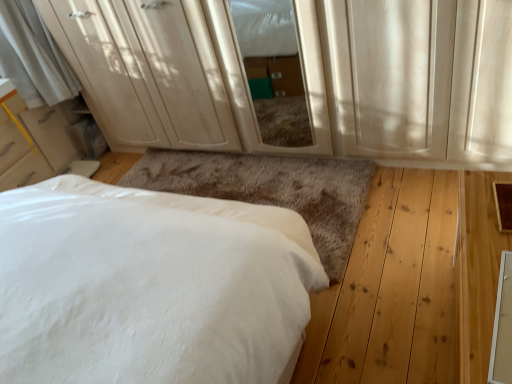
The height and width of the screenshot is (384, 512). What do you see at coordinates (148, 286) in the screenshot?
I see `white soft bed at lower left` at bounding box center [148, 286].

The image size is (512, 384). I want to click on matte wood screen door at center, so click(x=247, y=82).

The width and height of the screenshot is (512, 384). What do you see at coordinates (146, 71) in the screenshot? I see `matte white dresser at upper center` at bounding box center [146, 71].

This screenshot has height=384, width=512. I want to click on white soft bed at lower left, so click(x=148, y=286).

From the image's perspective, is white soft bed at lower left located beneath matte wood screen door at center?

Correct, white soft bed at lower left appears lower than matte wood screen door at center in the image.

How different are the orientations of white soft bed at lower left and matte wood screen door at center in degrees?

The angle between the facing direction of white soft bed at lower left and the facing direction of matte wood screen door at center is 0.261 degrees.

Is white soft bed at lower left taller or shorter than matte wood screen door at center?

Clearly, white soft bed at lower left is shorter compared to matte wood screen door at center.

Is white soft bed at lower left looking in the opposite direction of matte wood screen door at center?

No, white soft bed at lower left is not facing away from matte wood screen door at center.

Considering the sizes of objects white soft bed at lower left and matte white dresser at upper center in the image provided, who is thinner, white soft bed at lower left or matte white dresser at upper center?

matte white dresser at upper center is thinner.

Locate an element on the screen. bed that is below the matte white dresser at upper center (from the image's perspective) is located at coordinates (148, 286).

From a real-world perspective, is white soft bed at lower left on matte white dresser at upper center?

No, from a real-world perspective, white soft bed at lower left is not over matte white dresser at upper center

From the image's perspective, is matte wood screen door at center beneath matte white dresser at upper center?

Correct, matte wood screen door at center appears lower than matte white dresser at upper center in the image.

From a real-world perspective, which object rests below the other?

matte wood screen door at center, from a real-world perspective.

Looking at this image, does matte wood screen door at center turn towards matte white dresser at upper center?

No, matte wood screen door at center is not oriented towards matte white dresser at upper center.

Can you confirm if matte white dresser at upper center is bigger than white soft bed at lower left?

No, matte white dresser at upper center is not bigger than white soft bed at lower left.

Does matte white dresser at upper center have a lesser height compared to white soft bed at lower left?

Incorrect, the height of matte white dresser at upper center does not fall short of that of white soft bed at lower left.

Is matte white dresser at upper center to the left of white soft bed at lower left from the viewer's perspective?

Correct, you'll find matte white dresser at upper center to the left of white soft bed at lower left.

Is the position of matte wood screen door at center more distant than that of white soft bed at lower left?

Yes, it is.

Is matte wood screen door at center smaller than white soft bed at lower left?

Correct, matte wood screen door at center occupies less space than white soft bed at lower left.

Which of these two, matte wood screen door at center or white soft bed at lower left, is wider?

white soft bed at lower left is wider.

From a real-world perspective, between matte white dresser at upper center and matte wood screen door at center, who is vertically lower?

In real-world perspective, matte wood screen door at center is lower.

Is point (158, 48) closer or farther from the camera than point (203, 0)?

Point (158, 48) appears to be farther away from the viewer than point (203, 0).

Is matte white dresser at upper center positioned with its back to matte wood screen door at center?

No.

Where is `screen door to the right of white soft bed at lower left`? The height and width of the screenshot is (384, 512). screen door to the right of white soft bed at lower left is located at coordinates (247, 82).

Identify the location of bed that appears below the matte white dresser at upper center (from a real-world perspective). This screenshot has width=512, height=384. (148, 286).

Which object lies nearer to the anchor point matte white dresser at upper center, white soft bed at lower left or matte wood screen door at center?

matte wood screen door at center is closer to matte white dresser at upper center.

Looking at the image, which one is located further to white soft bed at lower left, matte white dresser at upper center or matte wood screen door at center?

matte white dresser at upper center.

Considering their positions, is white soft bed at lower left positioned closer to matte wood screen door at center than matte white dresser at upper center?

matte white dresser at upper center is closer to matte wood screen door at center.

Considering their positions, is matte wood screen door at center positioned further to white soft bed at lower left than matte white dresser at upper center?

matte white dresser at upper center is further to white soft bed at lower left.

Which object lies further to the anchor point matte wood screen door at center, matte white dresser at upper center or white soft bed at lower left?

The object further to matte wood screen door at center is white soft bed at lower left.

When comparing their distances from matte white dresser at upper center, does matte wood screen door at center or white soft bed at lower left seem further?

white soft bed at lower left is further to matte white dresser at upper center.

Where is `screen door between matte white dresser at upper center and white soft bed at lower left from top to bottom`? The width and height of the screenshot is (512, 384). screen door between matte white dresser at upper center and white soft bed at lower left from top to bottom is located at coordinates (247, 82).